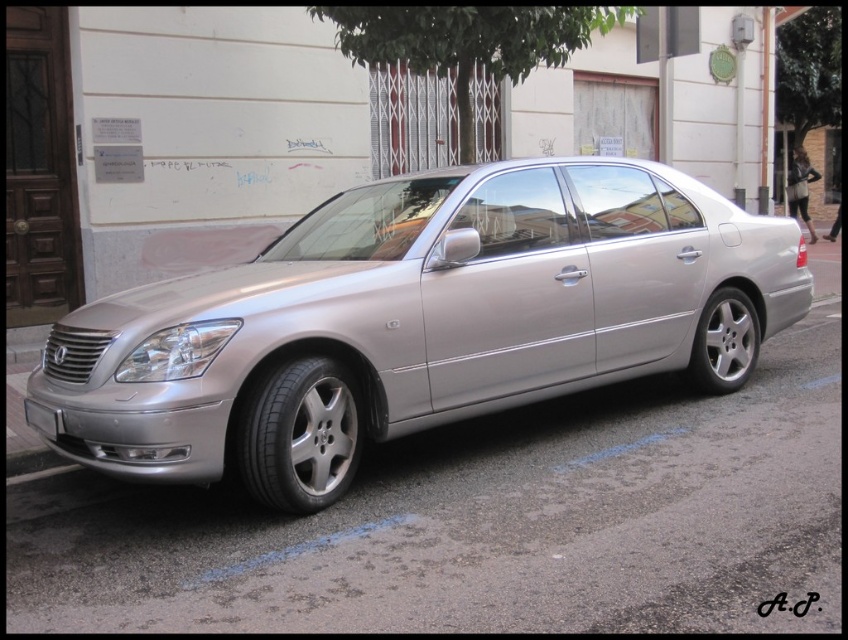
Question: Is silver metallic car at center below metallic gray curb at lower left?

Choices:
 (A) no
 (B) yes

Answer: (A)

Question: In this image, where is silver metallic car at center located relative to metallic gray curb at lower left?

Choices:
 (A) right
 (B) left

Answer: (A)

Question: Is silver metallic car at center positioned before metallic gray curb at lower left?

Choices:
 (A) yes
 (B) no

Answer: (A)